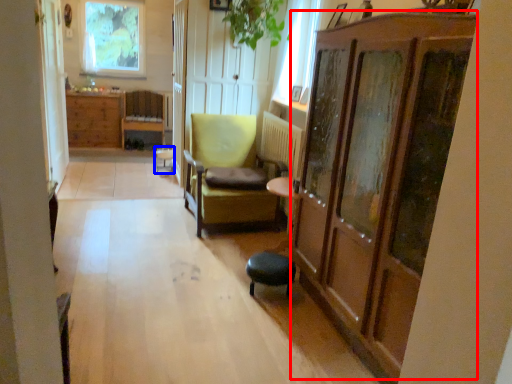
Question: Which point is further to the camera, dresser (highlighted by a red box) or bar stool (highlighted by a blue box)?

Choices:
 (A) dresser
 (B) bar stool

Answer: (B)